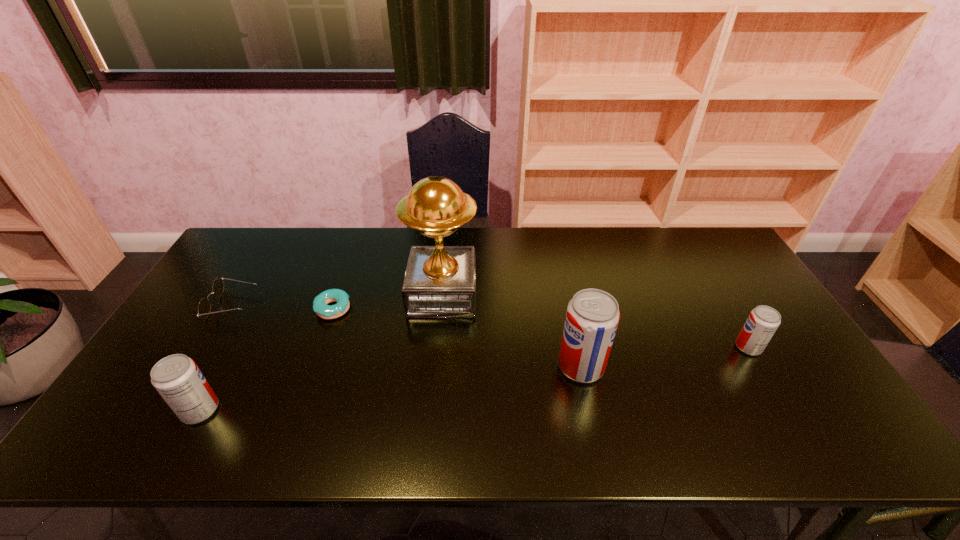
At what (x,y) coordinates should I click in order to perform the action: click on object positioned at the near left corner. Please return your answer as a coordinate pair (x, y). This screenshot has height=540, width=960. Looking at the image, I should click on (177, 378).

I want to click on vacant space at the far edge of the desktop, so tap(532, 235).

Locate an element on the screen. This screenshot has height=540, width=960. vacant space at the left edge of the desktop is located at coordinates (150, 372).

Where is `vacant area at the right edge of the desktop`? This screenshot has width=960, height=540. vacant area at the right edge of the desktop is located at coordinates (800, 354).

The image size is (960, 540). I want to click on vacant space at the far left corner, so click(x=271, y=233).

This screenshot has height=540, width=960. In the image, there is a desktop. Identify the location of free space at the far right corner. (701, 232).

Identify the location of free point between the shortest object and the award. The height and width of the screenshot is (540, 960). (388, 301).

Locate an element on the screen. unoccupied area between the spectacles and the tallest soda is located at coordinates (407, 335).

Locate an element on the screen. free point between the third object from left to right and the shortest soda is located at coordinates (540, 328).

The height and width of the screenshot is (540, 960). I want to click on vacant area that lies between the second object from right to left and the shortest soda, so [664, 357].